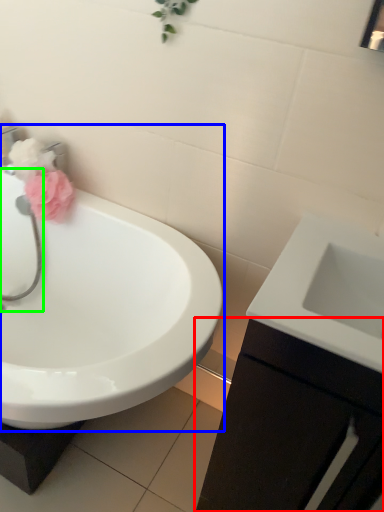
Question: Estimate the real-world distances between objects in this image. Which object is farther from bathroom cabinet (highlighted by a red box), sink (highlighted by a blue box) or plumbing fixture (highlighted by a green box)?

Choices:
 (A) sink
 (B) plumbing fixture

Answer: (B)